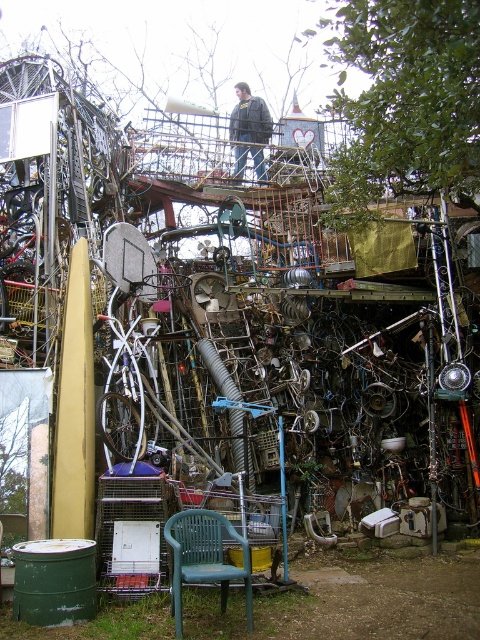
You are a hiker who has just arrived at this outdoor area. You see the green plastic chair at lower center and the dark gray jacket at upper center. Which object is positioned higher from the ground?

The dark gray jacket at upper center is positioned higher from the ground than the green plastic chair at lower center.

You are standing at the origin point in the image. Which object is closest to you, the green plastic chair at lower center or the large cylindrical object leaning against the metal structure?

The green plastic chair at lower center is closer to you because its coordinates are at point (204, 557), which is closer to the origin compared to the large cylindrical object.

You are a delivery person who needs to deliver a package to the dark gray jacket at upper center. You are currently standing next to the green plastic chair at lower center. Can you walk straight towards the jacket without any obstacles? Explain your reasoning.

The green plastic chair at lower center is 19.41 meters away from the dark gray jacket at upper center. Since the scene is cluttered with discarded items and structures, there might be obstacles between them. However, the question doesn not provide information about obstacles, so we can assume a straight path is possible unless stated otherwise. Therefore, yes, you can walk straight towards the jacket.